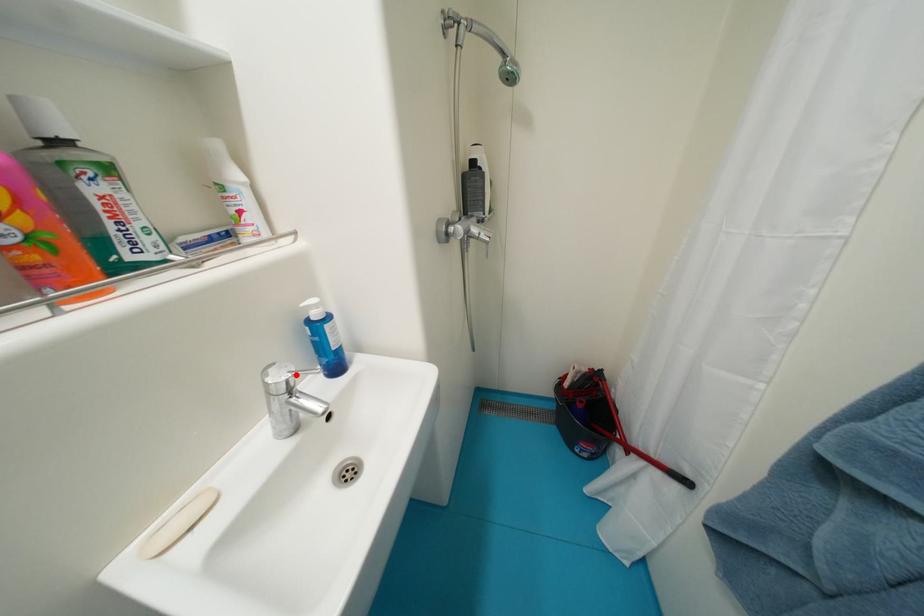
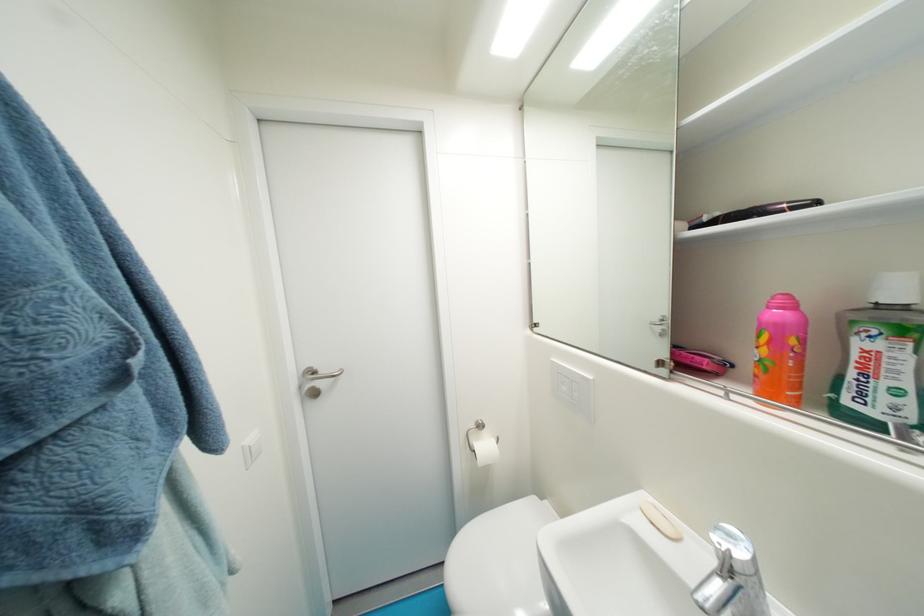
Question: I am providing you with two images of the same scene from different viewpoints. Given a red point in image1, look at the same physical point in image2. Is it:

Choices:
 (A) Closer to the viewpoint
 (B) Farther from the viewpoint

Answer: (B)